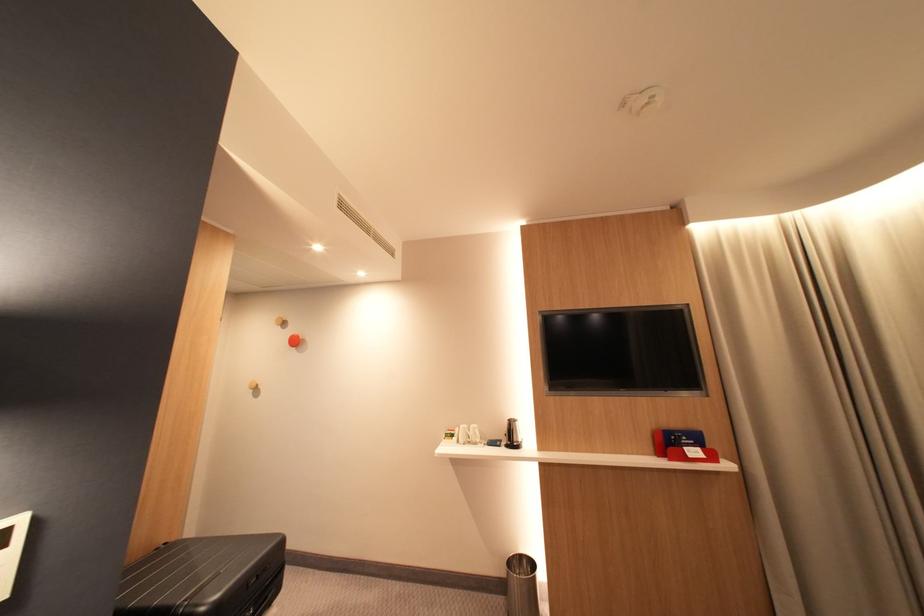
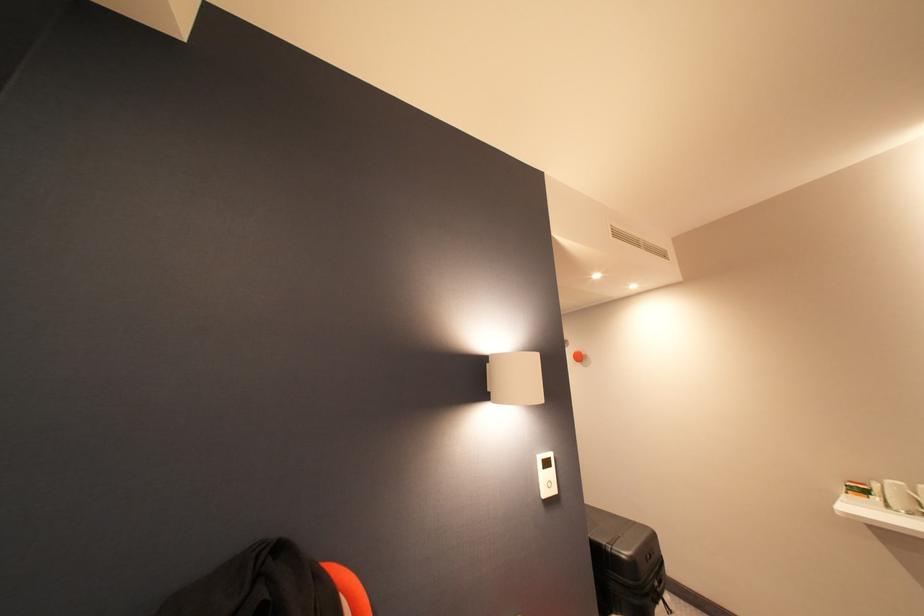
Question: The camera is either moving clockwise (left) or counter-clockwise (right) around the object. The first image is from the beginning of the video and the second image is from the end. Is the camera moving left or right when shooting the video?

Choices:
 (A) Left
 (B) Right

Answer: (B)